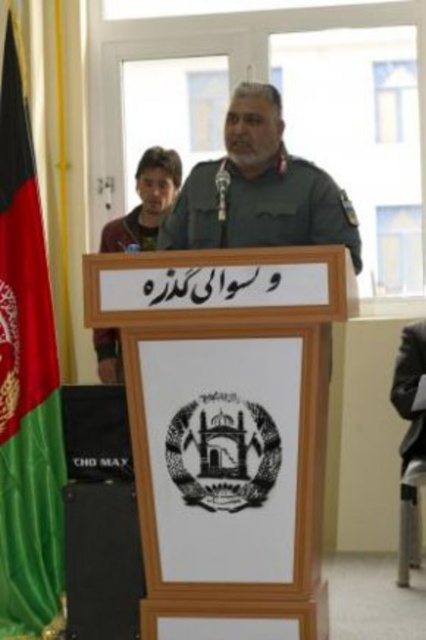
Who is more forward, [224,129] or [112,230]?

Point [112,230]

Is point (187, 243) less distant than point (108, 243)?

Yes, it is in front of point (108, 243).

Where is `green military uniform at center`? The image size is (426, 640). green military uniform at center is located at coordinates (259, 189).

Is green fabric flag at left wider than green military uniform at center?

No, green fabric flag at left is not wider than green military uniform at center.

Can you confirm if green fabric flag at left is positioned to the left of green military uniform at center?

Yes, green fabric flag at left is to the left of green military uniform at center.

This screenshot has width=426, height=640. Find the location of `green fabric flag at left`. green fabric flag at left is located at coordinates (25, 380).

Is point (258, 163) positioned in front of point (408, 440)?

That is True.

Which is in front, point (201, 225) or point (422, 337)?

Point (201, 225) is more forward.

The width and height of the screenshot is (426, 640). I want to click on green military uniform at center, so click(259, 189).

Where is `green military uniform at center`? This screenshot has width=426, height=640. green military uniform at center is located at coordinates (259, 189).